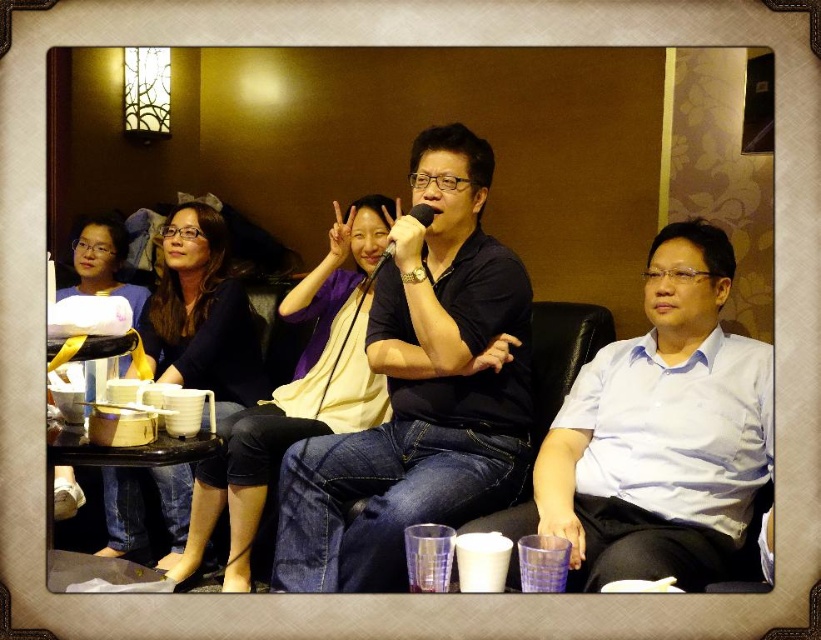
Where is the light blue shirt at center located in the image?

The light blue shirt at center is located at point coordinates of 0.680 on the x axis and 0.803 on the y axis.

You are standing in the room and want to greet both the matte black shirt at center and the matte black shirt at upper left. Which one should you approach first if you want to greet the person closer to you?

The matte black shirt at center is above the matte black shirt at upper left, so the matte black shirt at upper left is closer to you. You should approach the matte black shirt at upper left first.